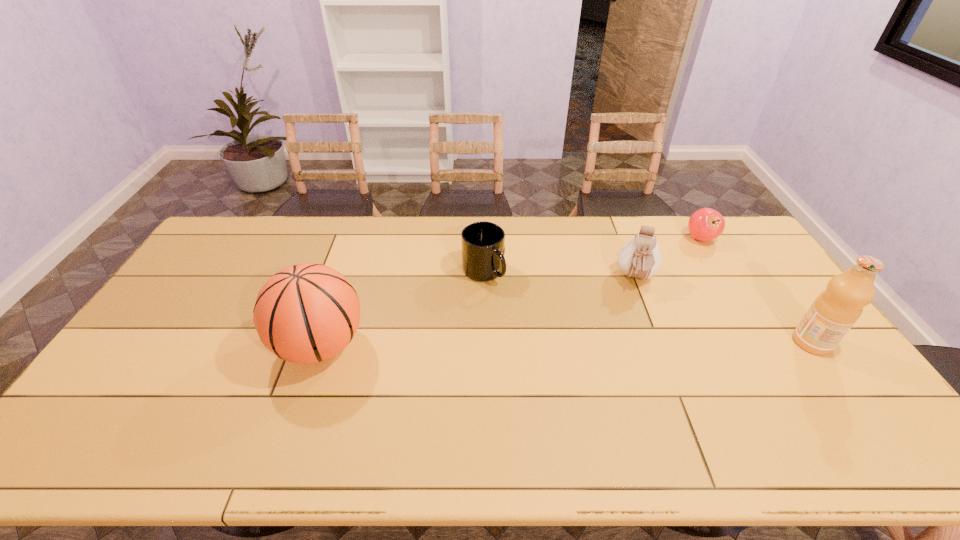
The height and width of the screenshot is (540, 960). Find the location of `basketball`. basketball is located at coordinates (306, 313).

Locate an element on the screen. Image resolution: width=960 pixels, height=540 pixels. the rightmost object is located at coordinates (835, 310).

I want to click on pouch, so click(x=640, y=258).

Where is `the third object from right to left`? the third object from right to left is located at coordinates (640, 258).

Find the location of a particular element. the second shortest object is located at coordinates [483, 243].

At what (x,y) coordinates should I click in order to perform the action: click on mug. Please return your answer as a coordinate pair (x, y). This screenshot has height=540, width=960. Looking at the image, I should click on (483, 243).

The image size is (960, 540). Identify the location of the second object from right to left. (706, 224).

Find the location of a particular element. The height and width of the screenshot is (540, 960). the farthest object is located at coordinates (706, 224).

Identify the location of vacant area located on the front of the leftmost object. (297, 416).

At what (x,y) coordinates should I click in order to perform the action: click on vacant region located on the front-facing side of the third object from right to left. Please return your answer as a coordinate pair (x, y). Looking at the image, I should click on (638, 346).